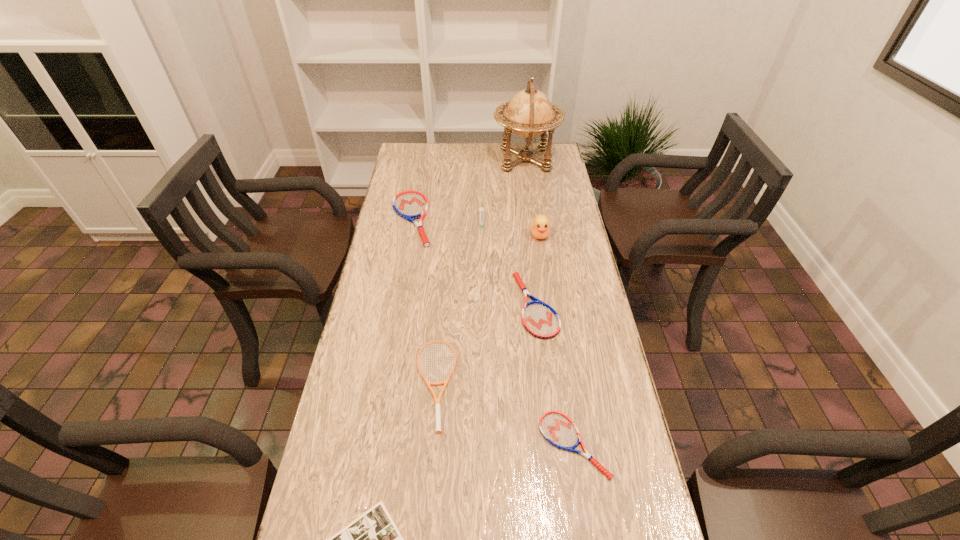
You are a GUI agent. You are given a task and a screenshot of the screen. Output one action in this format:
    pyautogui.click(x=<x>, y=<y>)
    Task: Click on the third closest object relative to the farthest object
    The image size is (960, 540).
    Given the screenshot: What is the action you would take?
    pyautogui.click(x=540, y=227)

Identify the location of the closest object relative to the second farthest blue tennis racket. The height and width of the screenshot is (540, 960). (540, 227).

Locate an element on the screen. the closest tennis racket to the beige tennis racket is located at coordinates (540, 320).

I want to click on tennis racket that stands as the closest to the beige tennis racket, so click(540, 320).

The image size is (960, 540). I want to click on blue tennis racket that is the second closest to the shortest object, so click(x=540, y=320).

Locate an element on the screen. The height and width of the screenshot is (540, 960). blue tennis racket that is the second closest to the smallest blue tennis racket is located at coordinates (410, 205).

What are the coordinates of `vacant region that satisfies the following two spatial constraints: 1. at the needle end of the second biggest blue tennis racket; 2. on the right side of the fourth object from left to right` in the screenshot? It's located at (482, 305).

You are a GUI agent. You are given a task and a screenshot of the screen. Output one action in this format:
    pyautogui.click(x=<x>, y=<y>)
    Task: Click on the vacant region that satisfies the following two spatial constraints: 1. on the face of the nearest blue tennis racket; 2. on the left side of the duckling
    
    Given the screenshot: What is the action you would take?
    (571, 445)